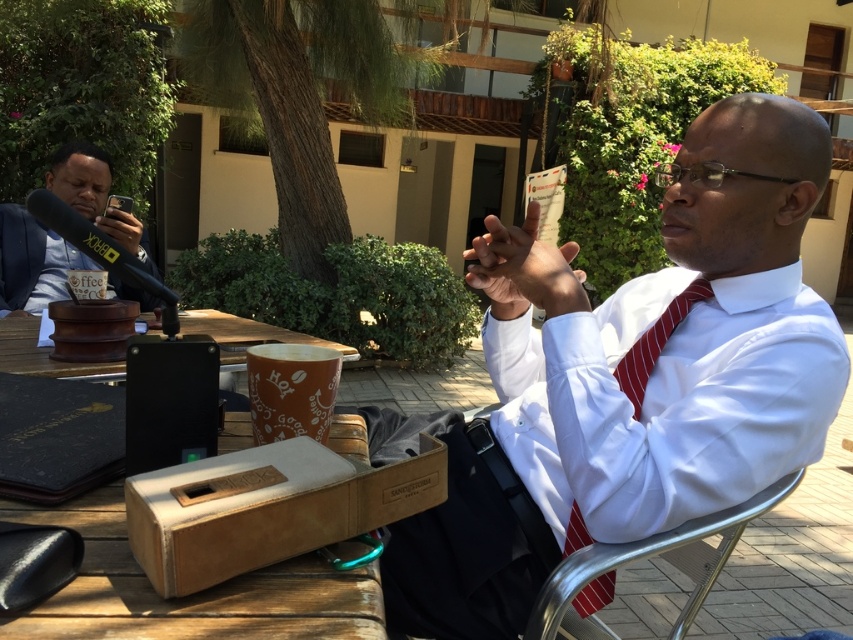
Does brown wooden table at center have a lesser width compared to red striped tie at center?

No, brown wooden table at center is not thinner than red striped tie at center.

Describe the element at coordinates (248, 336) in the screenshot. I see `brown wooden table at center` at that location.

Which is behind, point (119, 365) or point (596, 602)?

Positioned behind is point (119, 365).

What are the coordinates of `brown wooden table at center` in the screenshot? It's located at (248, 336).

Does matte black microphone at left appear on the left side of red striped tie at center?

Correct, you'll find matte black microphone at left to the left of red striped tie at center.

Find the location of `matte black microphone at left`. matte black microphone at left is located at coordinates (32, 260).

Which is behind, point (91, 157) or point (596, 592)?

The point (91, 157) is behind.

Locate an element on the screen. The width and height of the screenshot is (853, 640). matte black microphone at left is located at coordinates (32, 260).

What do you see at coordinates (190, 595) in the screenshot?
I see `wooden picnic table at center` at bounding box center [190, 595].

Is wooden picnic table at center taller than red striped tie at center?

No.

I want to click on wooden picnic table at center, so coord(190,595).

The width and height of the screenshot is (853, 640). I want to click on wooden picnic table at center, so click(x=190, y=595).